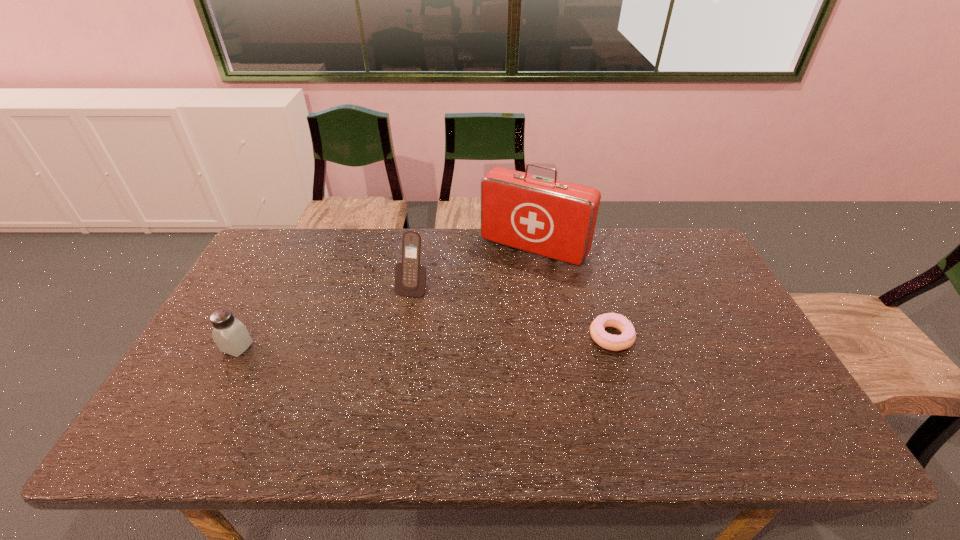
Where is `free space located 0.180m on the front-facing side of the third object from right to left`? Image resolution: width=960 pixels, height=540 pixels. free space located 0.180m on the front-facing side of the third object from right to left is located at coordinates pos(389,345).

Find the location of a particular element. This screenshot has width=960, height=540. free space located 0.260m on the front-facing side of the third object from right to left is located at coordinates (378, 368).

At what (x,y) coordinates should I click in order to perform the action: click on free location located 0.310m on the side of the farthest object with the first aid cross symbol. Please return your answer as a coordinate pair (x, y). This screenshot has height=540, width=960. Looking at the image, I should click on (468, 334).

This screenshot has height=540, width=960. I want to click on free space located 0.370m on the side of the farthest object with the first aid cross symbol, so click(x=458, y=349).

Image resolution: width=960 pixels, height=540 pixels. I want to click on vacant area located 0.320m on the side of the farthest object with the first aid cross symbol, so click(x=467, y=336).

The height and width of the screenshot is (540, 960). In order to click on object present at the far edge in this screenshot , I will do `click(556, 219)`.

Identify the location of object present at the left edge. (231, 336).

Find the location of `free space at the far edge`. free space at the far edge is located at coordinates (331, 252).

Identify the location of vacant space at the near edge. (614, 382).

Where is `vacant space at the right edge of the desktop`? vacant space at the right edge of the desktop is located at coordinates (683, 281).